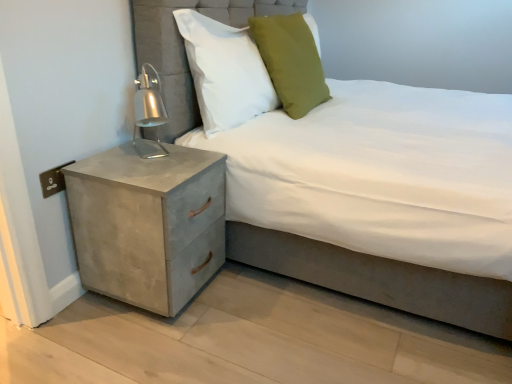
Locate an element on the screen. This screenshot has width=512, height=384. blank space situated above concrete textured nightstand at lower left (from a real-world perspective) is located at coordinates (148, 161).